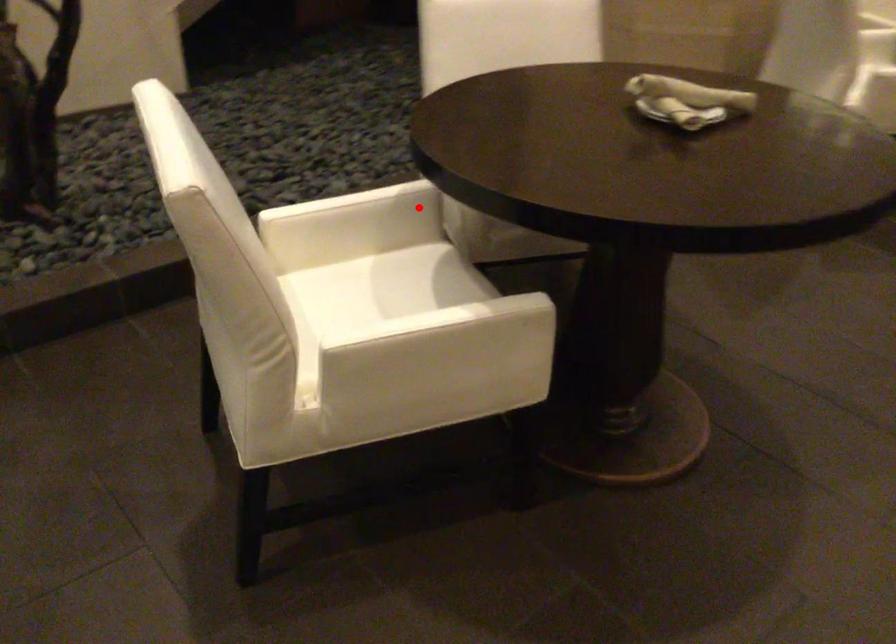
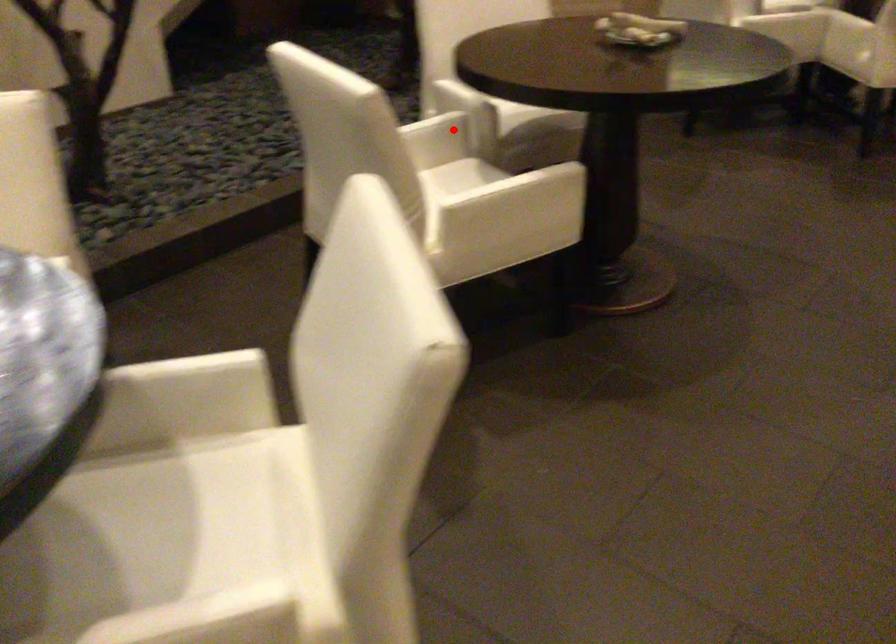
I am providing you with two images of the same scene from different viewpoints. A red point is marked on the first image and another point is marked on the second image. Do the highlighted points in image1 and image2 indicate the same real-world spot?

Yes